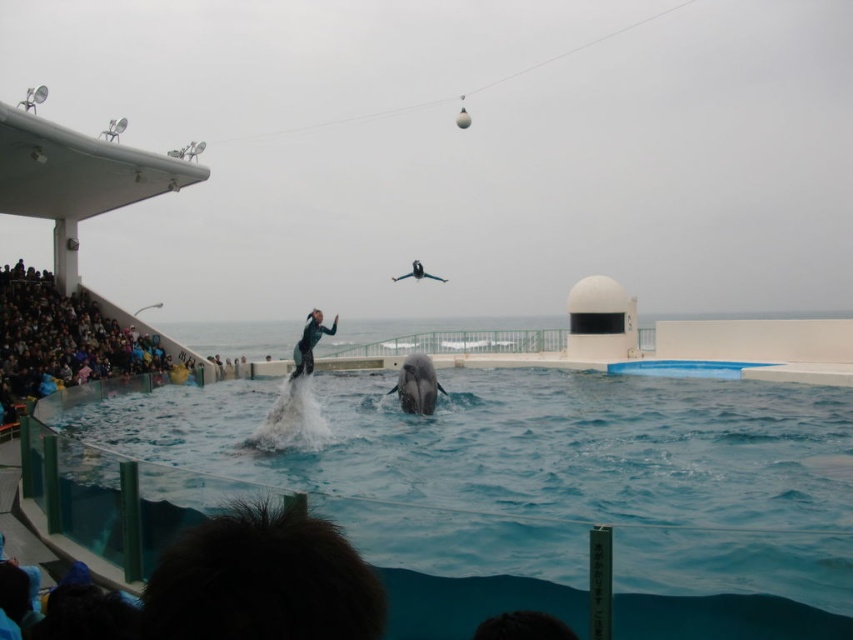
Question: Does clear blue water at lower center come behind dark blue fabric crowd at lower left?

Choices:
 (A) yes
 (B) no

Answer: (B)

Question: Based on their relative distances, which object is farther from the clear blue water at lower center?

Choices:
 (A) green wetsuit at center
 (B) dark blue fabric crowd at lower left
 (C) gray smooth dolphin at center

Answer: (B)

Question: Can you confirm if gray smooth dolphin at center is positioned above green wetsuit at center?

Choices:
 (A) yes
 (B) no

Answer: (B)

Question: Is the position of clear blue water at lower center less distant than that of gray smooth dolphin at center?

Choices:
 (A) yes
 (B) no

Answer: (A)

Question: Which of the following is the closest to the observer?

Choices:
 (A) dark blue fabric crowd at lower left
 (B) gray smooth dolphin at center
 (C) green wetsuit at center

Answer: (C)

Question: Which point is closer to the camera taking this photo?

Choices:
 (A) (51, 330)
 (B) (305, 332)
 (C) (415, 355)
 (D) (467, 595)

Answer: (D)